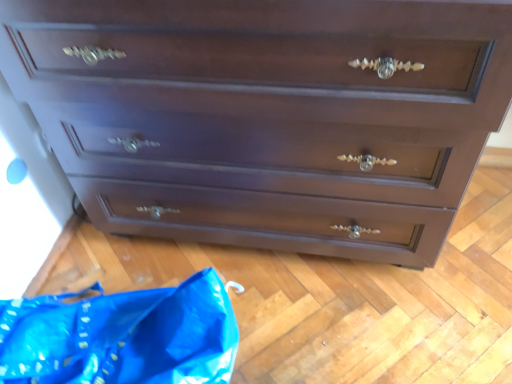
Question: Considering the relative sizes of dark wood chest of drawers at center and blue plastic bag at lower left in the image provided, is dark wood chest of drawers at center wider than blue plastic bag at lower left?

Choices:
 (A) yes
 (B) no

Answer: (A)

Question: Is dark wood chest of drawers at center not near blue plastic bag at lower left?

Choices:
 (A) yes
 (B) no

Answer: (B)

Question: Is the position of dark wood chest of drawers at center more distant than that of blue plastic bag at lower left?

Choices:
 (A) yes
 (B) no

Answer: (B)

Question: Considering the relative positions of dark wood chest of drawers at center and blue plastic bag at lower left in the image provided, is dark wood chest of drawers at center to the left of blue plastic bag at lower left from the viewer's perspective?

Choices:
 (A) no
 (B) yes

Answer: (A)

Question: Is dark wood chest of drawers at center facing towards blue plastic bag at lower left?

Choices:
 (A) yes
 (B) no

Answer: (A)

Question: Can you confirm if dark wood chest of drawers at center is taller than blue plastic bag at lower left?

Choices:
 (A) no
 (B) yes

Answer: (B)

Question: Considering the relative sizes of blue plastic bag at lower left and dark wood chest of drawers at center in the image provided, is blue plastic bag at lower left shorter than dark wood chest of drawers at center?

Choices:
 (A) no
 (B) yes

Answer: (B)

Question: Would you say dark wood chest of drawers at center is part of blue plastic bag at lower left's contents?

Choices:
 (A) yes
 (B) no

Answer: (B)

Question: Considering the relative sizes of blue plastic bag at lower left and dark wood chest of drawers at center in the image provided, is blue plastic bag at lower left thinner than dark wood chest of drawers at center?

Choices:
 (A) yes
 (B) no

Answer: (A)

Question: Is blue plastic bag at lower left positioned in front of dark wood chest of drawers at center?

Choices:
 (A) yes
 (B) no

Answer: (B)

Question: Does blue plastic bag at lower left have a greater width compared to dark wood chest of drawers at center?

Choices:
 (A) no
 (B) yes

Answer: (A)

Question: Is blue plastic bag at lower left far from dark wood chest of drawers at center?

Choices:
 (A) no
 (B) yes

Answer: (A)

Question: Is blue plastic bag at lower left in front of or behind dark wood chest of drawers at center in the image?

Choices:
 (A) behind
 (B) front

Answer: (A)